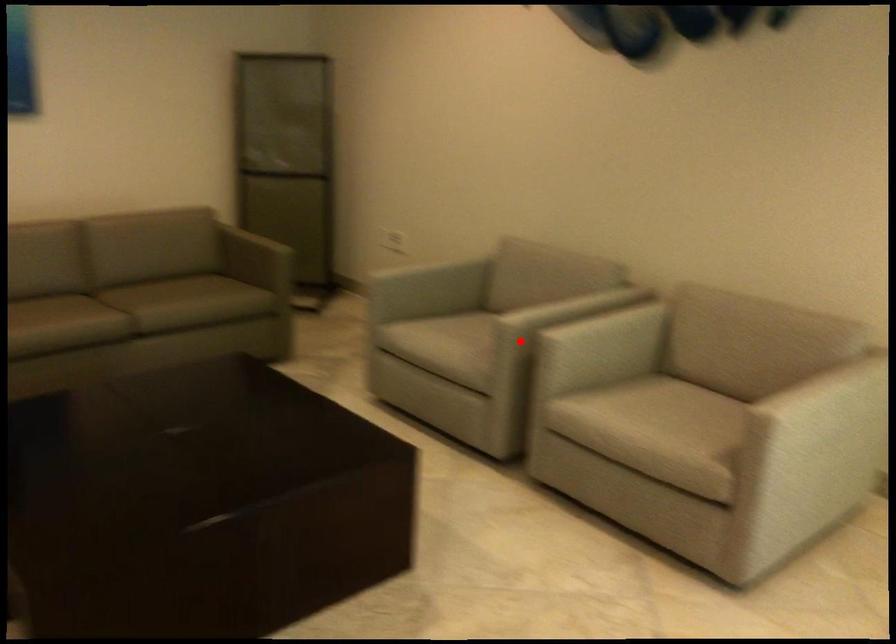
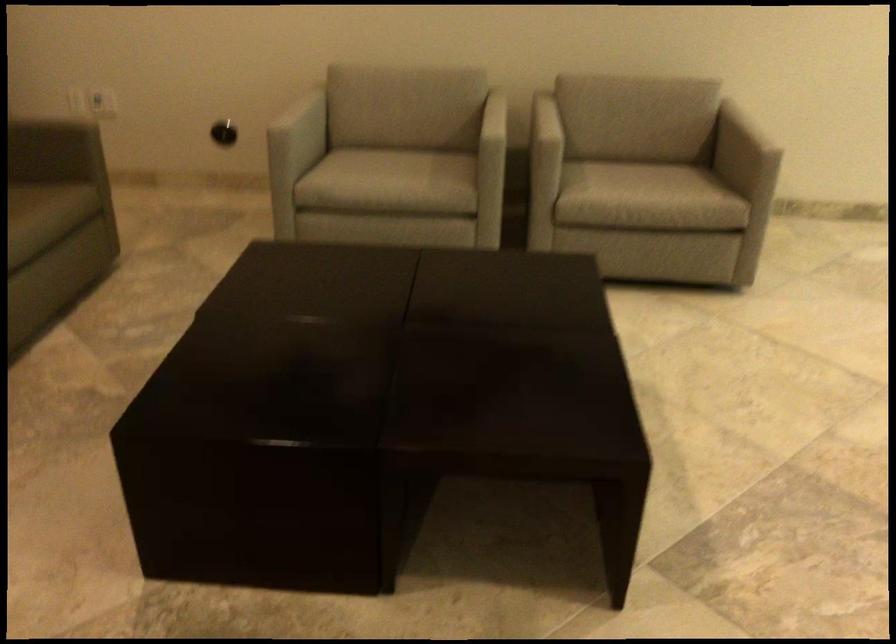
Locate, in the second image, the point that corresponds to the highlighted location in the first image.

(545, 140)